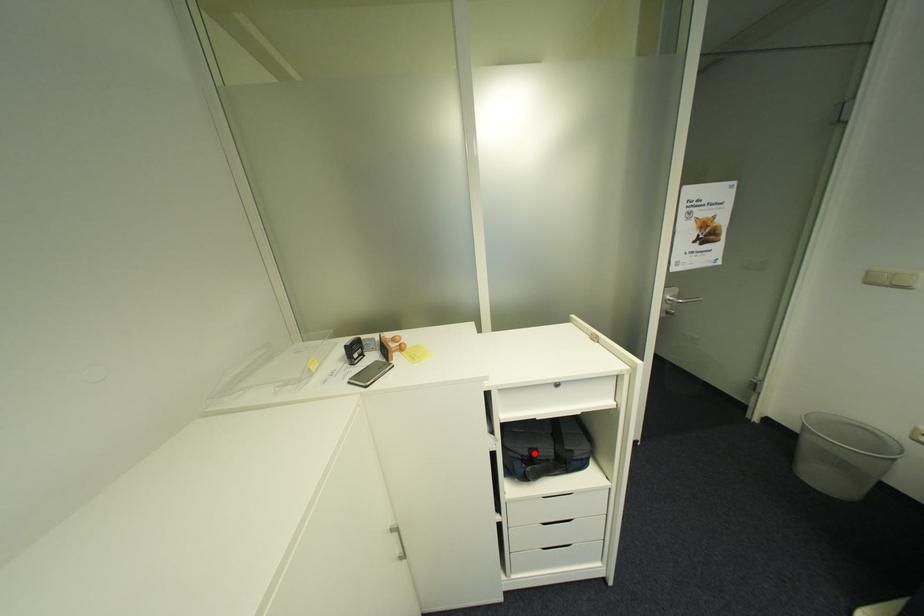
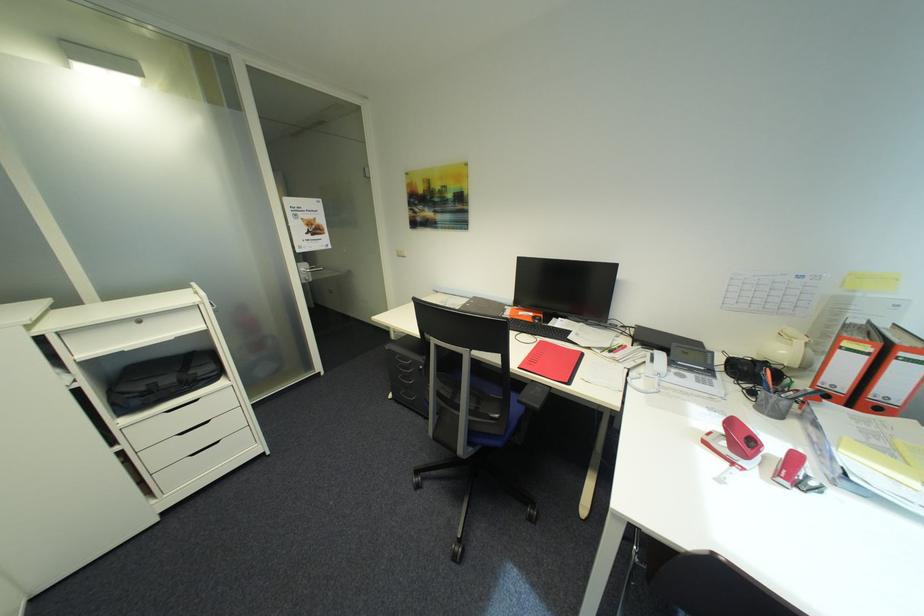
Locate, in the second image, the point that corresponds to the highlighted location in the first image.

(152, 389)